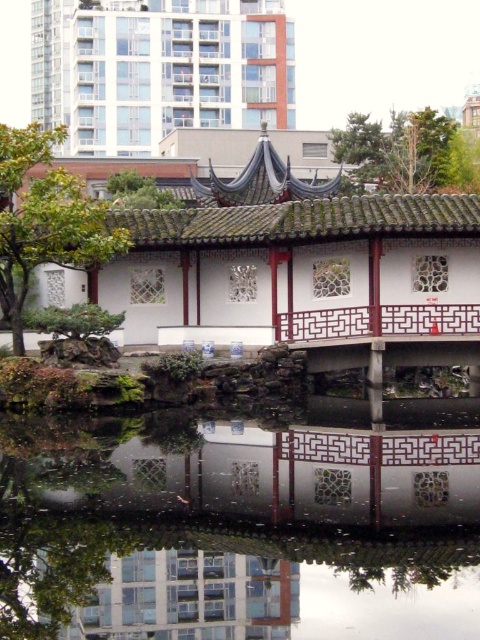
Is transparent glass water at center above green leafy tree at upper right?

Incorrect, transparent glass water at center is not positioned above green leafy tree at upper right.

Which is more to the right, transparent glass water at center or green leafy tree at upper right?

Positioned to the right is green leafy tree at upper right.

Is point (48, 588) closer to camera compared to point (398, 150)?

Yes, point (48, 588) is closer to viewer.

At what (x,y) coordinates should I click in order to perform the action: click on transparent glass water at center. Please return your answer as a coordinate pair (x, y). The height and width of the screenshot is (640, 480). Looking at the image, I should click on [228, 531].

Consider the image. Is green leafy tree at left thinner than green leafy tree at upper right?

In fact, green leafy tree at left might be wider than green leafy tree at upper right.

Which is below, green leafy tree at left or green leafy tree at upper right?

green leafy tree at left is below.

What do you see at coordinates (45, 220) in the screenshot? The width and height of the screenshot is (480, 640). I see `green leafy tree at left` at bounding box center [45, 220].

Where is `green leafy tree at left`? The image size is (480, 640). green leafy tree at left is located at coordinates pyautogui.click(x=45, y=220).

Which is above, transparent glass water at center or green leafy tree at left?

green leafy tree at left

Who is taller, transparent glass water at center or green leafy tree at left?

Standing taller between the two is green leafy tree at left.

Who is more forward, (47, 595) or (27, 243)?

Point (47, 595) is in front.

This screenshot has width=480, height=640. What are the coordinates of `transparent glass water at center` in the screenshot? It's located at (228, 531).